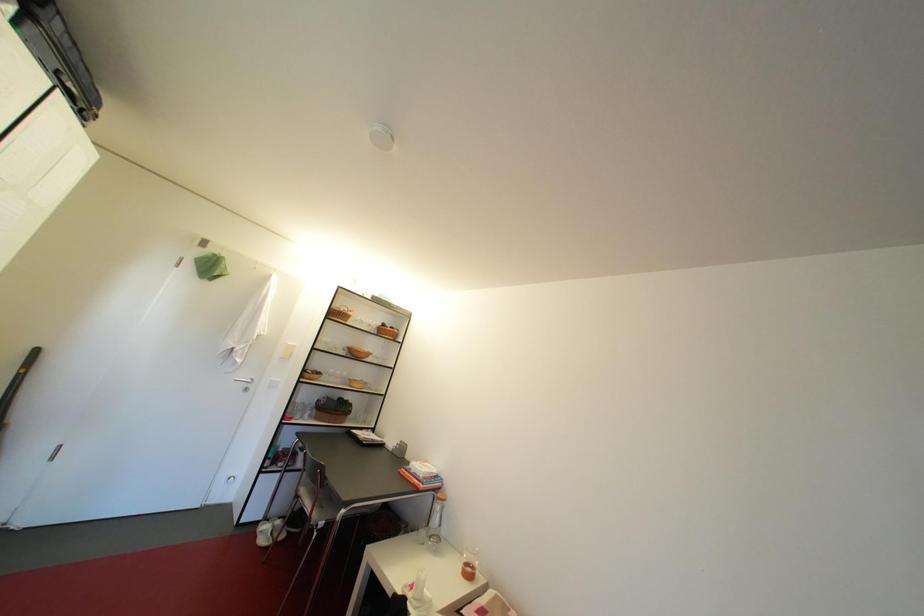
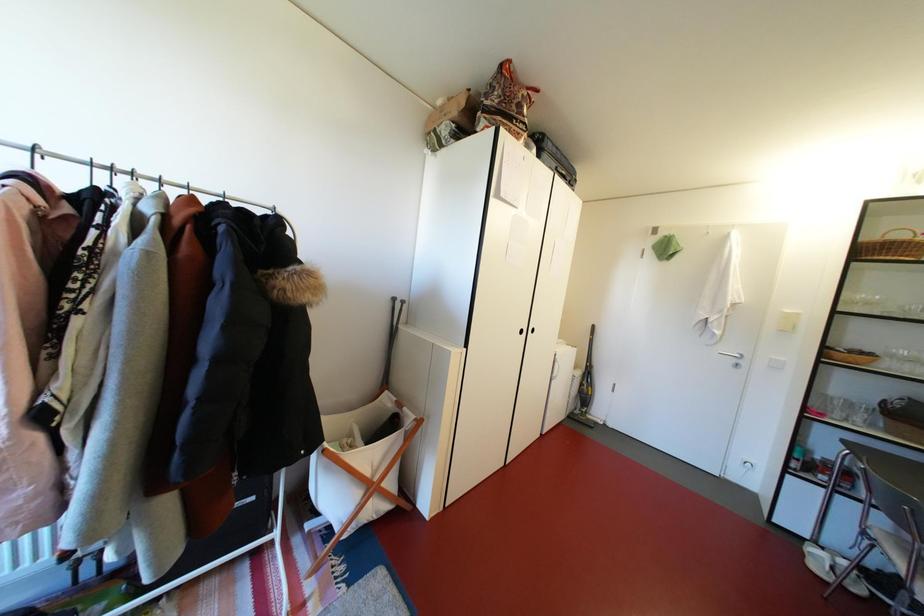
Question: The first image is from the beginning of the video and the second image is from the end. How did the camera likely rotate when shooting the video?

Choices:
 (A) Left
 (B) Right
 (C) Up
 (D) Down

Answer: (A)